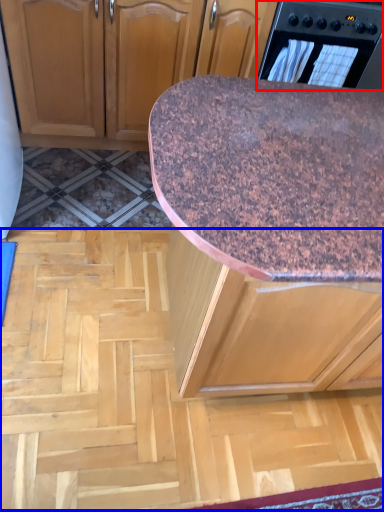
Question: Which point is further to the camera, home appliance (highlighted by a red box) or plywood (highlighted by a blue box)?

Choices:
 (A) home appliance
 (B) plywood

Answer: (A)